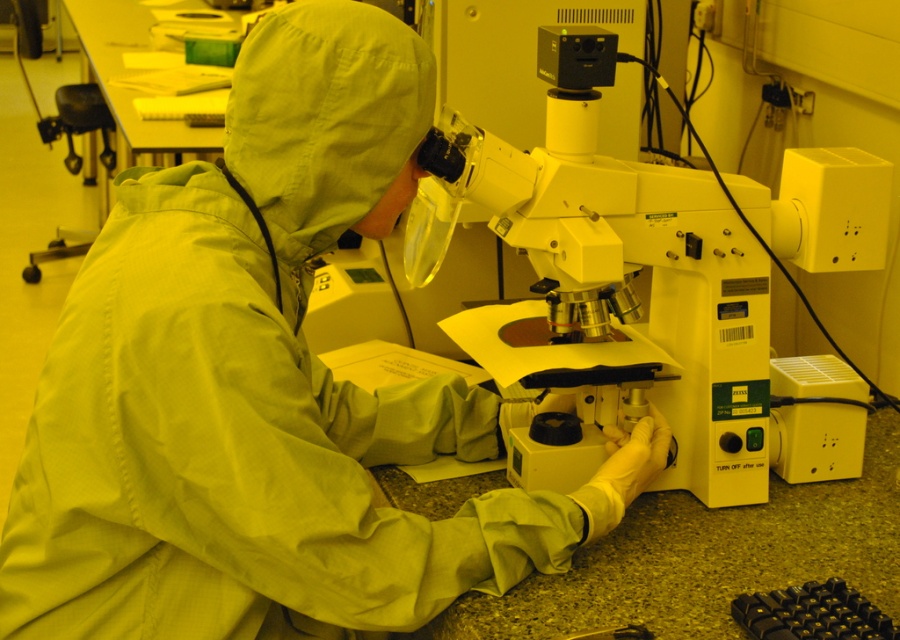
Question: Which object is closer to the camera taking this photo?

Choices:
 (A) white plastic microscope at center
 (B) green matte lab coat at center
 (C) black rubber keyboard at lower right

Answer: (B)

Question: Which point appears closest to the camera in this image?

Choices:
 (A) (382, 77)
 (B) (510, 220)

Answer: (A)

Question: Which object is closer to the camera taking this photo?

Choices:
 (A) white plastic microscope at center
 (B) black rubber keyboard at lower right
 (C) green matte lab coat at center

Answer: (C)

Question: Can you confirm if white plastic microscope at center is thinner than black rubber keyboard at lower right?

Choices:
 (A) yes
 (B) no

Answer: (B)

Question: Can you confirm if green matte lab coat at center is positioned above white plastic microscope at center?

Choices:
 (A) yes
 (B) no

Answer: (B)

Question: Is green matte lab coat at center above white plastic microscope at center?

Choices:
 (A) yes
 (B) no

Answer: (B)